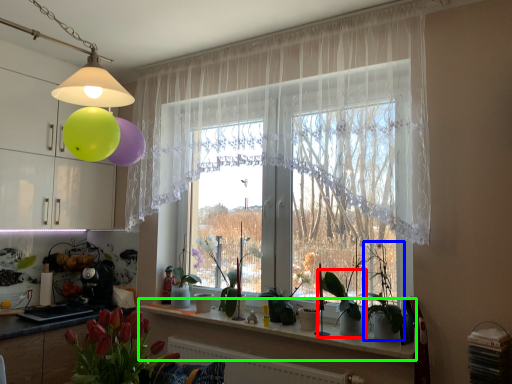
Question: Which object is positioned farthest from plant (highlighted by a red box)? Select from plant (highlighted by a blue box) and window sill (highlighted by a green box).

Choices:
 (A) plant
 (B) window sill

Answer: (B)